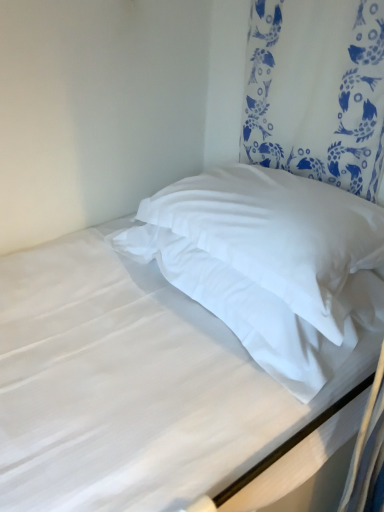
Question: Does white fabric curtain at upper right have a greater width compared to white soft pillow at center, which appears as the 2th pillow when ordered from the bottom?

Choices:
 (A) yes
 (B) no

Answer: (B)

Question: Can you confirm if white fabric curtain at upper right is taller than white soft pillow at center, which appears as the 2th pillow when ordered from the bottom?

Choices:
 (A) yes
 (B) no

Answer: (A)

Question: From a real-world perspective, is white fabric curtain at upper right beneath white soft pillow at center, which appears as the 2th pillow when ordered from the bottom?

Choices:
 (A) no
 (B) yes

Answer: (A)

Question: Does white fabric curtain at upper right have a lesser height compared to white soft pillow at center, positioned as the 1th pillow in top-to-bottom order?

Choices:
 (A) yes
 (B) no

Answer: (B)

Question: Could you tell me if white fabric curtain at upper right is facing white soft pillow at center, which appears as the 2th pillow when ordered from the bottom?

Choices:
 (A) no
 (B) yes

Answer: (A)

Question: Considering the positions of white soft pillow at center, which appears as the 2th pillow when ordered from the bottom, and white fabric curtain at upper right in the image, is white soft pillow at center, which appears as the 2th pillow when ordered from the bottom, taller or shorter than white fabric curtain at upper right?

Choices:
 (A) tall
 (B) short

Answer: (B)

Question: Is white soft pillow at center, which appears as the 2th pillow when ordered from the bottom, in front of or behind white fabric curtain at upper right in the image?

Choices:
 (A) behind
 (B) front

Answer: (B)

Question: Choose the correct answer: Is white soft pillow at center, positioned as the 1th pillow in top-to-bottom order, inside white fabric curtain at upper right or outside it?

Choices:
 (A) outside
 (B) inside

Answer: (A)

Question: Is white soft pillow at center, which appears as the 2th pillow when ordered from the bottom, bigger or smaller than white fabric curtain at upper right?

Choices:
 (A) small
 (B) big

Answer: (B)

Question: Do you think white soft pillow at center, the second pillow positioned from the top, is within white soft pillow at center, which appears as the 2th pillow when ordered from the bottom, or outside of it?

Choices:
 (A) outside
 (B) inside

Answer: (A)

Question: From a real-world perspective, relative to white soft pillow at center, which appears as the 2th pillow when ordered from the bottom, is white soft pillow at center, the second pillow positioned from the top, vertically above or below?

Choices:
 (A) above
 (B) below

Answer: (B)

Question: Is white soft pillow at center, which is the first pillow from bottom to top, taller or shorter than white soft pillow at center, positioned as the 1th pillow in top-to-bottom order?

Choices:
 (A) tall
 (B) short

Answer: (B)

Question: Visually, is white soft pillow at center, the second pillow positioned from the top, positioned to the left or to the right of white soft pillow at center, which appears as the 2th pillow when ordered from the bottom?

Choices:
 (A) left
 (B) right

Answer: (A)

Question: Based on their sizes in the image, would you say white soft pillow at center, positioned as the 1th pillow in top-to-bottom order, is bigger or smaller than white smooth pillow at upper right?

Choices:
 (A) big
 (B) small

Answer: (B)

Question: Do you think white soft pillow at center, which appears as the 2th pillow when ordered from the bottom, is within white smooth pillow at upper right, or outside of it?

Choices:
 (A) inside
 (B) outside

Answer: (B)